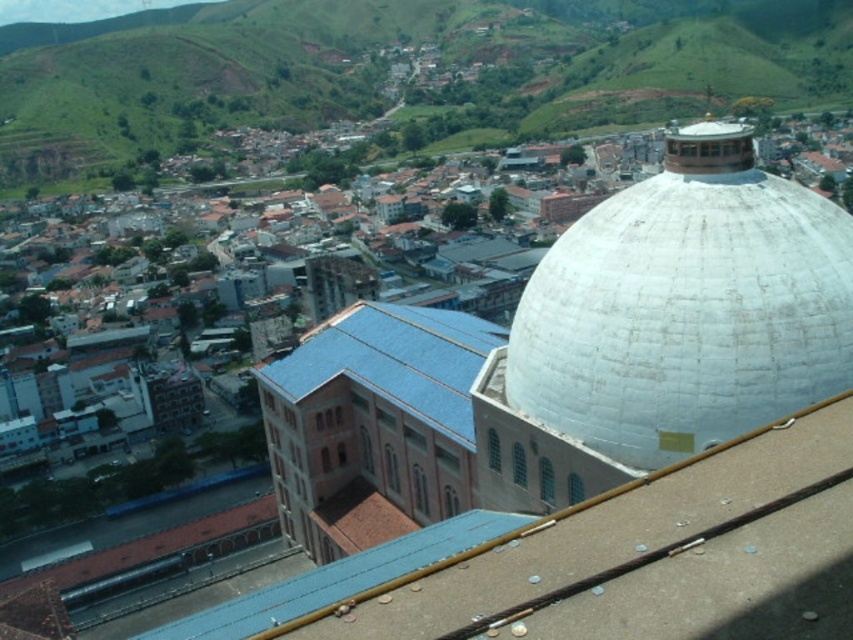
Who is positioned more to the right, green grassy hillside at upper center or blue tile roof at center?

From the viewer's perspective, blue tile roof at center appears more on the right side.

Does point (527, 131) come behind point (410, 326)?

Yes, it is.

Locate an element on the screen. The height and width of the screenshot is (640, 853). green grassy hillside at upper center is located at coordinates (390, 61).

Between white matte dome at upper right and blue tile roof at center, which one is positioned lower?

Positioned lower is blue tile roof at center.

Does white matte dome at upper right have a lesser height compared to blue tile roof at center?

No, white matte dome at upper right is not shorter than blue tile roof at center.

Is point (611, 452) positioned behind point (425, 346)?

No.

This screenshot has height=640, width=853. I want to click on white matte dome at upper right, so click(686, 307).

Between point (699, 33) and point (828, 307), which one is positioned in front?

Point (828, 307) is in front.

Which is behind, point (357, 36) or point (593, 208)?

The point (357, 36) is more distant.

I want to click on green grassy hillside at upper center, so pos(390,61).